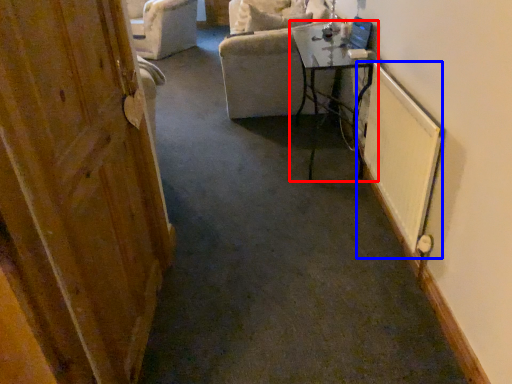
Question: Which of the following is the closest to the observer, table (highlighted by a red box) or radiator (highlighted by a blue box)?

Choices:
 (A) table
 (B) radiator

Answer: (B)